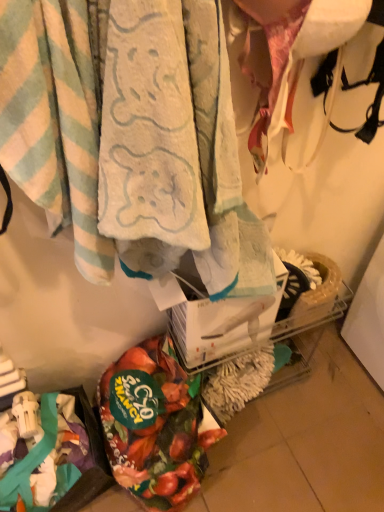
This screenshot has width=384, height=512. I want to click on light blue striped towel at upper left, arranged as the second towel when viewed from the right, so click(56, 117).

Is floral fabric bag at lower left aimed at light blue striped towel at upper left, arranged as the second towel when viewed from the right?

No, floral fabric bag at lower left is not turned towards light blue striped towel at upper left, arranged as the second towel when viewed from the right.

From a real-world perspective, which is physically below, floral fabric bag at lower left or light blue striped towel at upper left, marked as the 1th towel in a left-to-right arrangement?

In real-world perspective, floral fabric bag at lower left is lower.

Which of these two, floral fabric bag at lower left or light blue striped towel at upper left, marked as the 1th towel in a left-to-right arrangement, is smaller?

floral fabric bag at lower left.

Is floral fabric bag at lower left far from light blue striped towel at upper left, arranged as the second towel when viewed from the right?

No, there isn't a large distance between floral fabric bag at lower left and light blue striped towel at upper left, arranged as the second towel when viewed from the right.

From a real-world perspective, between soft cotton towel at center, which ranks as the 2th towel in left-to-right order, and light blue striped towel at upper left, arranged as the second towel when viewed from the right, who is vertically lower?

soft cotton towel at center, which ranks as the 2th towel in left-to-right order, from a real-world perspective.

From the image's perspective, which is below, soft cotton towel at center, which appears as the first towel when viewed from the right, or light blue striped towel at upper left, arranged as the second towel when viewed from the right?

light blue striped towel at upper left, arranged as the second towel when viewed from the right.

Does soft cotton towel at center, which appears as the first towel when viewed from the right, have a greater width compared to light blue striped towel at upper left, arranged as the second towel when viewed from the right?

Yes, soft cotton towel at center, which appears as the first towel when viewed from the right, is wider than light blue striped towel at upper left, arranged as the second towel when viewed from the right.

Find the location of a particular element. This screenshot has width=384, height=512. towel located on the left of soft cotton towel at center, which appears as the first towel when viewed from the right is located at coordinates (56, 117).

From the picture: How many degrees apart are the facing directions of light blue striped towel at upper left, marked as the 1th towel in a left-to-right arrangement, and soft cotton towel at center, which appears as the first towel when viewed from the right?

There is a 0.000109-degree angle between the facing directions of light blue striped towel at upper left, marked as the 1th towel in a left-to-right arrangement, and soft cotton towel at center, which appears as the first towel when viewed from the right.

Does light blue striped towel at upper left, arranged as the second towel when viewed from the right, touch soft cotton towel at center, which ranks as the 2th towel in left-to-right order?

Absolutely, light blue striped towel at upper left, arranged as the second towel when viewed from the right, is next to and touching soft cotton towel at center, which ranks as the 2th towel in left-to-right order.

Where is `towel above the light blue striped towel at upper left, arranged as the second towel when viewed from the right (from the image's perspective)`? Image resolution: width=384 pixels, height=512 pixels. towel above the light blue striped towel at upper left, arranged as the second towel when viewed from the right (from the image's perspective) is located at coordinates (131, 137).

Which of these two, light blue striped towel at upper left, marked as the 1th towel in a left-to-right arrangement, or soft cotton towel at center, which appears as the first towel when viewed from the right, is wider?

soft cotton towel at center, which appears as the first towel when viewed from the right, is wider.

Looking at this image, which of these two, soft cotton towel at center, which ranks as the 2th towel in left-to-right order, or floral fabric bag at lower left, is thinner?

With smaller width is soft cotton towel at center, which ranks as the 2th towel in left-to-right order.

From a real-world perspective, who is located lower, soft cotton towel at center, which appears as the first towel when viewed from the right, or floral fabric bag at lower left?

floral fabric bag at lower left.

Which point is more distant from viewer, (50, 135) or (151, 441)?

The point (151, 441) is farther.

What's the angular difference between soft cotton towel at center, which appears as the first towel when viewed from the right, and floral fabric bag at lower left's facing directions?

They differ by 0.000138 degrees in their facing directions.

Who is more distant, light blue striped towel at upper left, marked as the 1th towel in a left-to-right arrangement, or floral fabric bag at lower left?

Positioned behind is floral fabric bag at lower left.

Considering the relative sizes of light blue striped towel at upper left, arranged as the second towel when viewed from the right, and floral fabric bag at lower left in the image provided, is light blue striped towel at upper left, arranged as the second towel when viewed from the right, bigger than floral fabric bag at lower left?

Yes.

How many degrees apart are the facing directions of light blue striped towel at upper left, marked as the 1th towel in a left-to-right arrangement, and floral fabric bag at lower left?

They differ by 3.22e-05 degrees in their facing directions.

Would you say light blue striped towel at upper left, marked as the 1th towel in a left-to-right arrangement, is outside floral fabric bag at lower left?

light blue striped towel at upper left, marked as the 1th towel in a left-to-right arrangement, is positioned outside floral fabric bag at lower left.

Considering the positions of objects floral fabric bag at lower left and soft cotton towel at center, which ranks as the 2th towel in left-to-right order, in the image provided, who is more to the right, floral fabric bag at lower left or soft cotton towel at center, which ranks as the 2th towel in left-to-right order,?

Positioned to the right is soft cotton towel at center, which ranks as the 2th towel in left-to-right order.

Is floral fabric bag at lower left touching soft cotton towel at center, which appears as the first towel when viewed from the right?

floral fabric bag at lower left and soft cotton towel at center, which appears as the first towel when viewed from the right, are clearly separated.

From a real-world perspective, is floral fabric bag at lower left positioned above or below soft cotton towel at center, which appears as the first towel when viewed from the right?

From a real-world perspective, floral fabric bag at lower left is physically below soft cotton towel at center, which appears as the first towel when viewed from the right.

You are a GUI agent. You are given a task and a screenshot of the screen. Output one action in this format:
    pyautogui.click(x=<x>, y=<y>)
    Task: Click on the towel on the left of floral fabric bag at lower left
    The height and width of the screenshot is (512, 384).
    Given the screenshot: What is the action you would take?
    pyautogui.click(x=56, y=117)

The image size is (384, 512). I want to click on towel that is below the soft cotton towel at center, which appears as the first towel when viewed from the right (from the image's perspective), so click(56, 117).

Considering their positions, is light blue striped towel at upper left, marked as the 1th towel in a left-to-right arrangement, positioned closer to floral fabric bag at lower left than soft cotton towel at center, which ranks as the 2th towel in left-to-right order?

soft cotton towel at center, which ranks as the 2th towel in left-to-right order, lies closer to floral fabric bag at lower left than the other object.

Estimate the real-world distances between objects in this image. Which object is closer to soft cotton towel at center, which ranks as the 2th towel in left-to-right order, floral fabric bag at lower left or light blue striped towel at upper left, marked as the 1th towel in a left-to-right arrangement?

Among the two, light blue striped towel at upper left, marked as the 1th towel in a left-to-right arrangement, is located nearer to soft cotton towel at center, which ranks as the 2th towel in left-to-right order.

Based on their spatial positions, is soft cotton towel at center, which ranks as the 2th towel in left-to-right order, or floral fabric bag at lower left closer to light blue striped towel at upper left, arranged as the second towel when viewed from the right?

The object closer to light blue striped towel at upper left, arranged as the second towel when viewed from the right, is soft cotton towel at center, which ranks as the 2th towel in left-to-right order.

Estimate the real-world distances between objects in this image. Which object is further from floral fabric bag at lower left, soft cotton towel at center, which appears as the first towel when viewed from the right, or light blue striped towel at upper left, arranged as the second towel when viewed from the right?

light blue striped towel at upper left, arranged as the second towel when viewed from the right, is further to floral fabric bag at lower left.

From the image, which object appears to be nearer to soft cotton towel at center, which ranks as the 2th towel in left-to-right order, light blue striped towel at upper left, marked as the 1th towel in a left-to-right arrangement, or floral fabric bag at lower left?

light blue striped towel at upper left, marked as the 1th towel in a left-to-right arrangement.

Which object lies further to the anchor point light blue striped towel at upper left, marked as the 1th towel in a left-to-right arrangement, floral fabric bag at lower left or soft cotton towel at center, which appears as the first towel when viewed from the right?

Based on the image, floral fabric bag at lower left appears to be further to light blue striped towel at upper left, marked as the 1th towel in a left-to-right arrangement.

The width and height of the screenshot is (384, 512). I want to click on towel positioned between light blue striped towel at upper left, marked as the 1th towel in a left-to-right arrangement, and floral fabric bag at lower left from near to far, so click(131, 137).